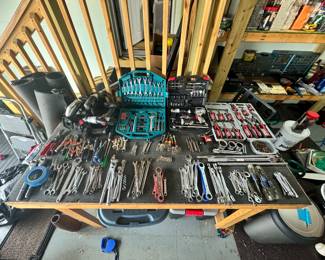
This screenshot has height=260, width=325. In order to click on stairs in this screenshot , I will do `click(89, 73)`.